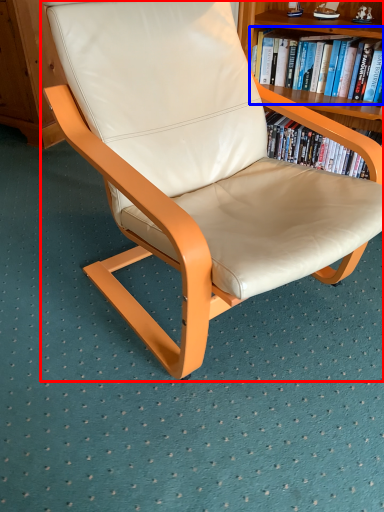
Question: Which object appears closest to the camera in this image, chair (highlighted by a red box) or book (highlighted by a blue box)?

Choices:
 (A) chair
 (B) book

Answer: (A)